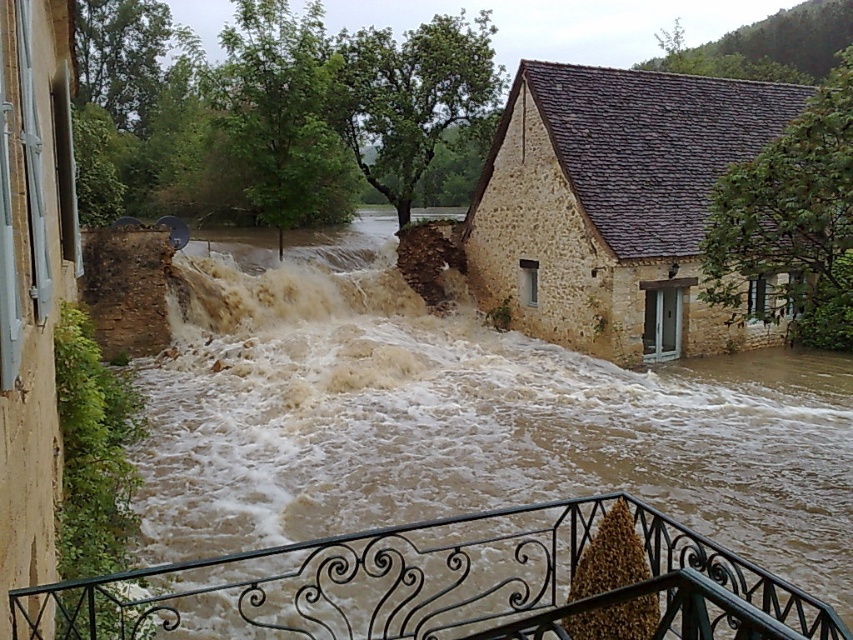
Based on the scene description, where is the point located at coordinates (463, 417)?

The point at coordinates (463, 417) is located in the brown muddy water at center.

You are a rescue worker trying to navigate through the flooded area. You need to reach a stranded person located at point 0.653, 0.544. Is the brown muddy water at center blocking your path?

The brown muddy water at center is located at point (463, 417), which is exactly where the stranded person is. Therefore, the brown muddy water at center is blocking the path to reach them.